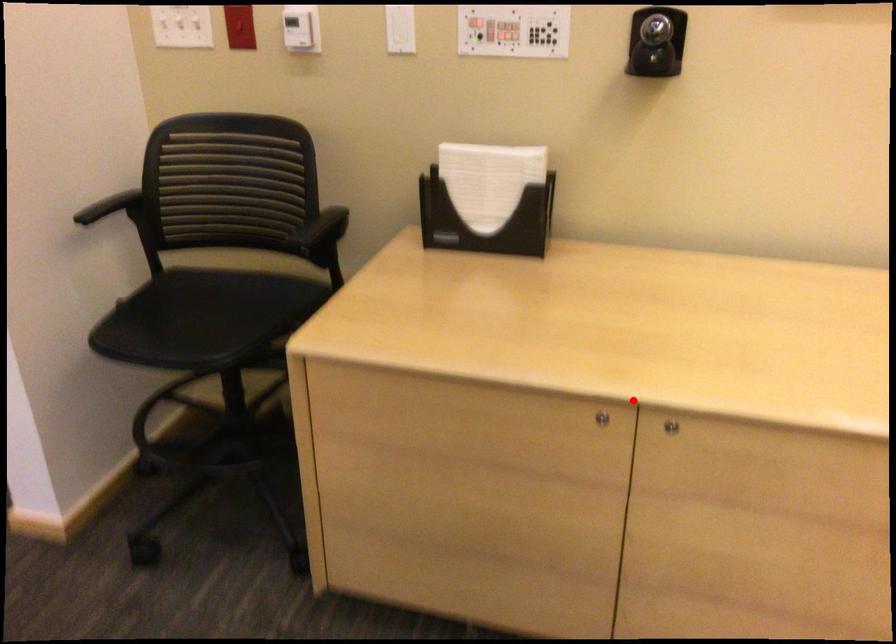
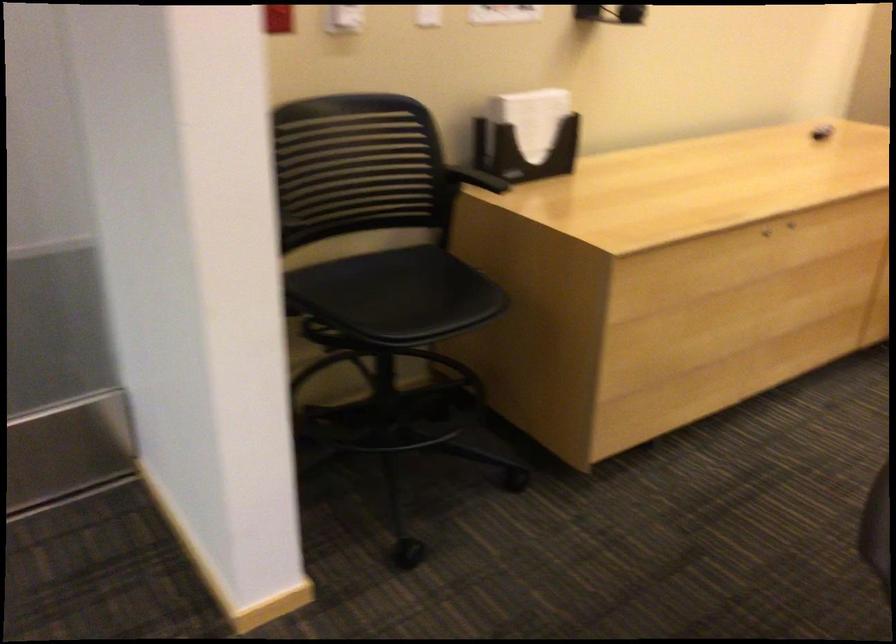
Question: I am providing you with two images of the same scene from different viewpoints. A red point is marked on the first image. Can you still see the location of the red point in image 2?

Choices:
 (A) Yes
 (B) No

Answer: (A)